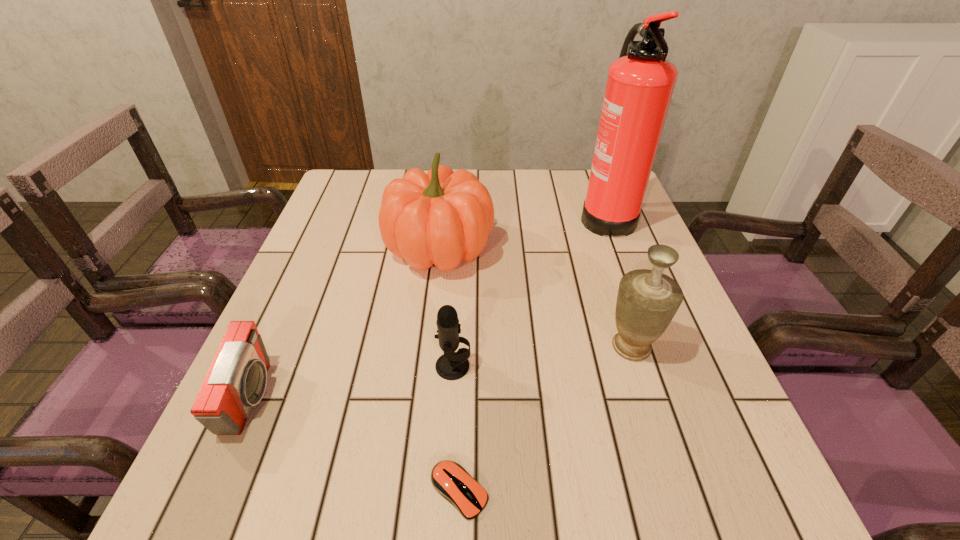
Locate an element on the screen. urn at the right edge is located at coordinates pyautogui.click(x=647, y=300).

In order to click on object that is positioned at the far right corner in this screenshot , I will do `click(640, 83)`.

You are a GUI agent. You are given a task and a screenshot of the screen. Output one action in this format:
    pyautogui.click(x=<x>, y=<y>)
    Task: Click on the blank space at the far edge
    This screenshot has width=960, height=540.
    Given the screenshot: What is the action you would take?
    pyautogui.click(x=503, y=178)

In the image, there is a desktop. Find the location of `free space at the left edge`. free space at the left edge is located at coordinates (296, 281).

Image resolution: width=960 pixels, height=540 pixels. I want to click on blank area at the right edge, so click(595, 252).

This screenshot has width=960, height=540. In the image, there is a desktop. Identify the location of vacant space at the far left corner. (359, 184).

Image resolution: width=960 pixels, height=540 pixels. I want to click on free space between the tallest object and the leftmost object, so click(428, 306).

Find the location of a particular element. The width and height of the screenshot is (960, 540). unoccupied position between the urn and the fire extinguisher is located at coordinates (618, 280).

The width and height of the screenshot is (960, 540). Find the location of `vacant area that lies between the third shortest object and the camera`. vacant area that lies between the third shortest object and the camera is located at coordinates (352, 382).

At what (x,y) coordinates should I click in order to perform the action: click on unoccupied area between the pumpkin and the urn. Please return your answer as a coordinate pair (x, y). The image size is (960, 540). Looking at the image, I should click on (536, 297).